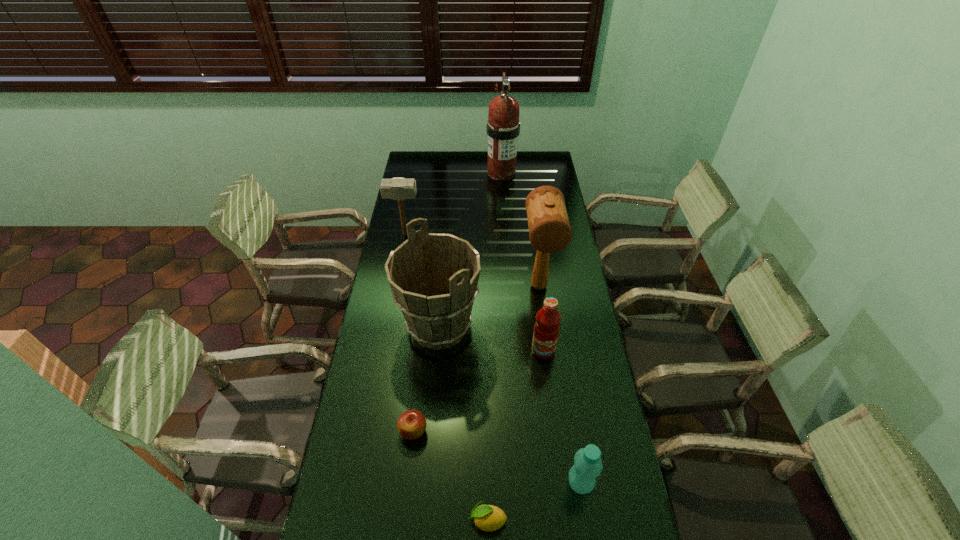
Where is `the farthest object`? The image size is (960, 540). the farthest object is located at coordinates (503, 127).

Identify the location of the tallest object. (503, 127).

The width and height of the screenshot is (960, 540). I want to click on the taller mallet, so click(549, 229).

In order to click on the right mallet in this screenshot , I will do `click(549, 229)`.

This screenshot has height=540, width=960. I want to click on bucket, so click(434, 277).

Where is `the shorter mallet`? the shorter mallet is located at coordinates (398, 189).

Identify the location of the farther mallet. (398, 189).

You are a GUI agent. You are given a task and a screenshot of the screen. Output one action in this format:
    pyautogui.click(x=<x>, y=<y>)
    Task: Click on the fruit juice
    
    Given the screenshot: What is the action you would take?
    pyautogui.click(x=546, y=329)

At what (x,y) coordinates should I click in order to perform the action: click on bottle. Please return your answer as a coordinate pair (x, y). Looking at the image, I should click on (587, 466).

You are a GUI agent. You are given a task and a screenshot of the screen. Output one action in this format:
    pyautogui.click(x=<x>, y=<y>)
    Task: Click on the sixth tallest object
    
    Given the screenshot: What is the action you would take?
    pyautogui.click(x=587, y=466)